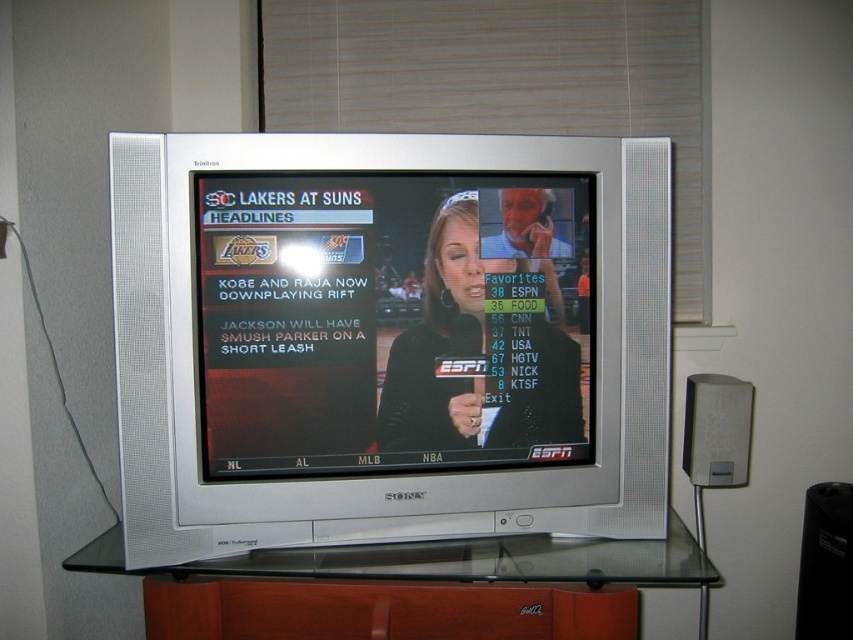
You are setting up a new entertainment center and need to arrange the matte black tv screen at center and the black fabric at center. Given their sizes, which object should be placed first to ensure proper fitting?

The matte black tv screen at center has a larger size compared to black fabric at center, so it should be placed first to ensure there is enough space for both items in the entertainment center.

Consider the image. You are standing in front of a vintage Sony Trinitron CRT television. You notice two items in the scene described as black fabric at center and satin silver speaker at right. Based on their positions, which one is closer to the left side of the television?

The black fabric at center is closer to the left side of the television because it is positioned to the left of the satin silver speaker at right.